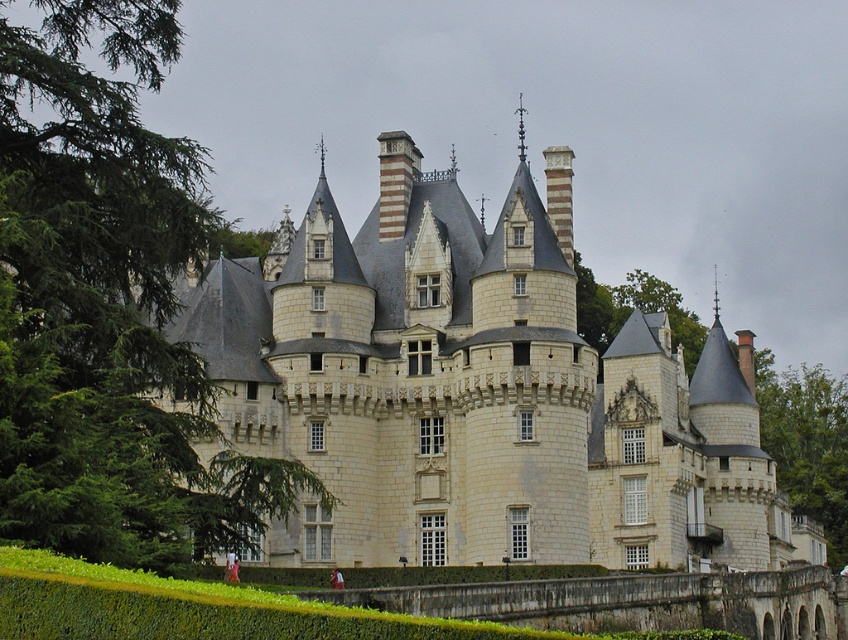
You are standing in front of the white stone castle at center and the green leafy tree at left. Which one do you think is taller?

The white stone castle at center is much taller than the green leafy tree at left according to the description.